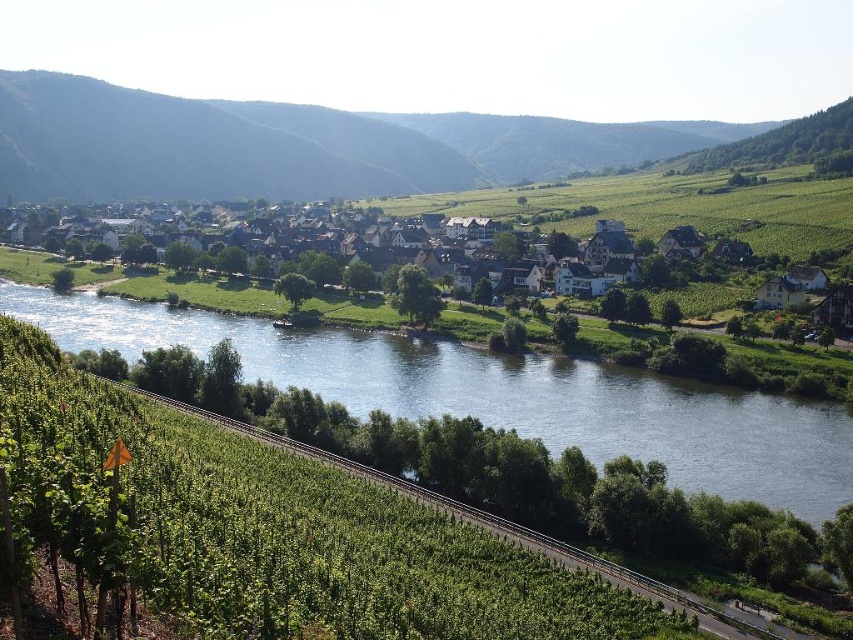
Who is shorter, white wooden houses at center or green grassy train track at lower left?

green grassy train track at lower left is shorter.

At what (x,y) coordinates should I click in order to perform the action: click on white wooden houses at center. Please return your answer as a coordinate pair (x, y). Image resolution: width=853 pixels, height=640 pixels. Looking at the image, I should click on (695, 216).

Locate an element on the screen. The image size is (853, 640). white wooden houses at center is located at coordinates (695, 216).

Locate an element on the screen. white wooden houses at center is located at coordinates (695, 216).

Which is in front, point (33, 70) or point (561, 554)?

Point (561, 554)

Does green grassy hillside at upper left have a lesser width compared to green grassy train track at lower left?

In fact, green grassy hillside at upper left might be wider than green grassy train track at lower left.

The image size is (853, 640). What do you see at coordinates (289, 145) in the screenshot?
I see `green grassy hillside at upper left` at bounding box center [289, 145].

In order to click on green grassy hillside at upper left in this screenshot , I will do pos(289,145).

Is point (152, 310) closer to viewer compared to point (454, 186)?

That is True.

Can you confirm if green grassy river at center is smaller than green grassy hillside at upper left?

Yes.

Measure the distance between point (815, 474) and camera.

They are 91.29 meters apart.

Identify the location of green grassy river at center. The width and height of the screenshot is (853, 640). (503, 396).